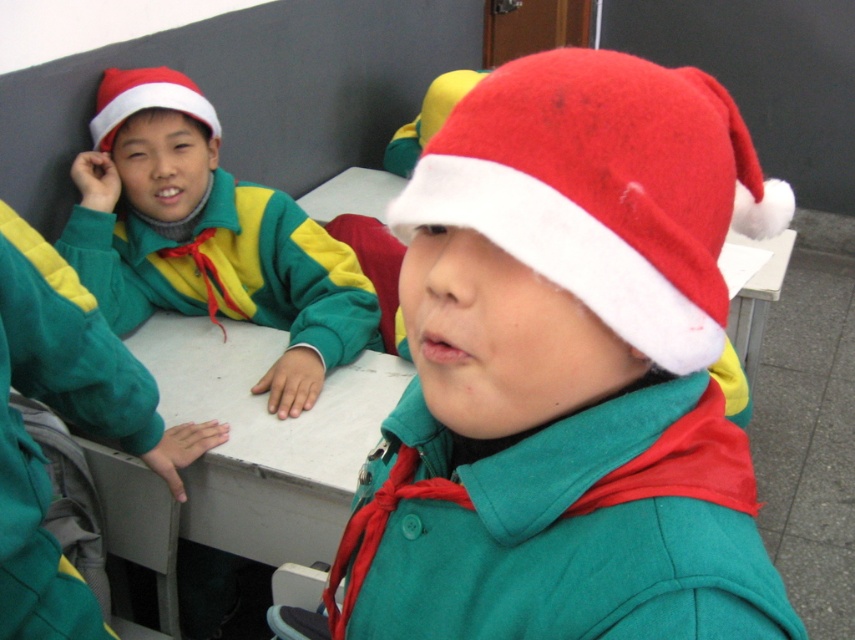
You are a teacher in the classroom and want to place a gift box on the white matte table at center. If the gift box requires a space of 0.25 meters in width, can it fit on the table?

The white matte table at center is located at point (264, 436), but the exact dimensions of the table are not provided. Therefore, it is uncertain whether the gift box will fit. Please check the table size before placing the gift box.

You are a tailor who needs to place a 6 inch wide decoration on the white matte table at center. The matte green jacket at center is nearby. Can the decoration fit between them without overlapping?

The matte green jacket at center is 6.20 inches from the white matte table at center. Since the decoration is 6 inches wide, it can fit between them as the distance is slightly larger than the decoration.

You are standing in a classroom and see the red felt santa hat at center. Can you determine its exact location based on the coordinates provided?

The red felt santa hat at center is located at point (604,189).